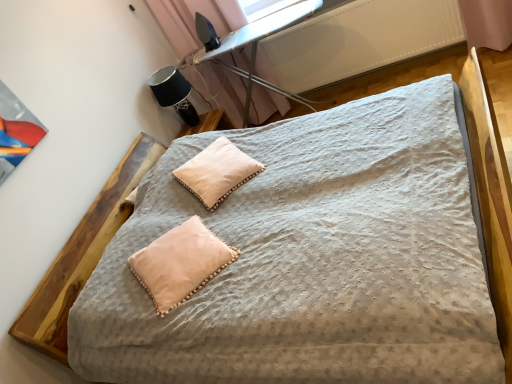
Question: Is point (190, 226) positioned closer to the camera than point (226, 148)?

Choices:
 (A) closer
 (B) farther

Answer: (A)

Question: Is peach velvet pillow at lower left, marked as the first pillow in a front-to-back arrangement, inside or outside of white soft pillow at center, the 1th pillow from the top?

Choices:
 (A) outside
 (B) inside

Answer: (A)

Question: Which object is the farthest from the peach velvet pillow at lower left, which appears as the first pillow when ordered from the bottom?

Choices:
 (A) white textured radiator at upper right
 (B) black fabric table lamp at upper left
 (C) white soft pillow at center, the second pillow positioned from the bottom
 (D) metal ironing board at upper center

Answer: (A)

Question: Which object is positioned closest to the metal ironing board at upper center?

Choices:
 (A) peach velvet pillow at lower left, marked as the first pillow in a front-to-back arrangement
 (B) black fabric table lamp at upper left
 (C) white soft pillow at center, the 1th pillow from the top
 (D) white textured radiator at upper right

Answer: (D)